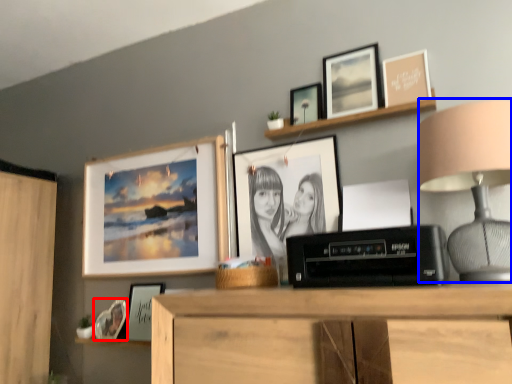
Question: Which of the following is the closest to the observer, picture frame (highlighted by a red box) or table lamp (highlighted by a blue box)?

Choices:
 (A) picture frame
 (B) table lamp

Answer: (B)